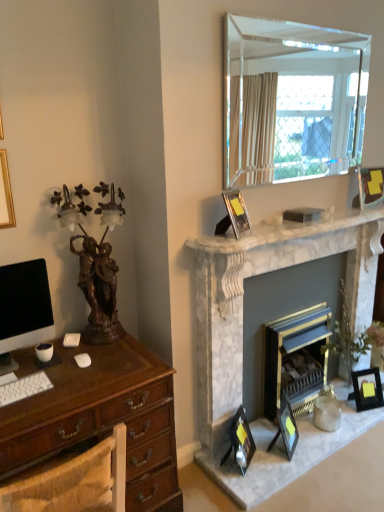
Question: Is white marble fireplace at upper center oriented towards matte black monitor at left?

Choices:
 (A) no
 (B) yes

Answer: (A)

Question: Is white marble fireplace at upper center directly adjacent to matte black monitor at left?

Choices:
 (A) yes
 (B) no

Answer: (B)

Question: Does white marble fireplace at upper center have a lesser height compared to matte black monitor at left?

Choices:
 (A) yes
 (B) no

Answer: (A)

Question: Considering the relative sizes of white marble fireplace at upper center and matte black monitor at left in the image provided, is white marble fireplace at upper center bigger than matte black monitor at left?

Choices:
 (A) yes
 (B) no

Answer: (A)

Question: Is white marble fireplace at upper center thinner than matte black monitor at left?

Choices:
 (A) no
 (B) yes

Answer: (A)

Question: Relative to silver metallic picture frame at upper center, acting as the second picture frame starting from the top, is matte black picture frame at lower center, which appears as the 2th picture frame when ordered from the bottom, in front or behind?

Choices:
 (A) front
 (B) behind

Answer: (B)

Question: Is matte black picture frame at lower center, which ranks as the 3th picture frame in right-to-left order, bigger or smaller than silver metallic picture frame at upper center, marked as the 4th picture frame in a bottom-to-top arrangement?

Choices:
 (A) small
 (B) big

Answer: (B)

Question: Choose the correct answer: Is matte black picture frame at lower center, which is the third picture frame in left-to-right order, inside silver metallic picture frame at upper center, the fifth picture frame from the right, or outside it?

Choices:
 (A) inside
 (B) outside

Answer: (B)

Question: From a real-world perspective, is matte black picture frame at lower center, which is counted as the 4th picture frame, starting from the top, above or below silver metallic picture frame at upper center, marked as the 4th picture frame in a bottom-to-top arrangement?

Choices:
 (A) below
 (B) above

Answer: (A)

Question: In the image, is matte black picture frame at lower center, which appears as the 2th picture frame when ordered from the bottom, on the left side or the right side of clear glass mirror at upper right?

Choices:
 (A) right
 (B) left

Answer: (B)

Question: Is matte black picture frame at lower center, which is the third picture frame in left-to-right order, spatially inside clear glass mirror at upper right, or outside of it?

Choices:
 (A) inside
 (B) outside

Answer: (B)

Question: In the image, is matte black picture frame at lower center, which appears as the 2th picture frame when ordered from the bottom, positioned in front of or behind clear glass mirror at upper right?

Choices:
 (A) front
 (B) behind

Answer: (B)

Question: Considering the positions of point (289, 458) and point (228, 124), is point (289, 458) closer or farther from the camera than point (228, 124)?

Choices:
 (A) closer
 (B) farther

Answer: (B)

Question: In terms of size, does matte black monitor at left appear bigger or smaller than clear glass mirror at upper right?

Choices:
 (A) big
 (B) small

Answer: (B)

Question: Considering the positions of point (48, 290) and point (278, 55), is point (48, 290) closer or farther from the camera than point (278, 55)?

Choices:
 (A) farther
 (B) closer

Answer: (B)